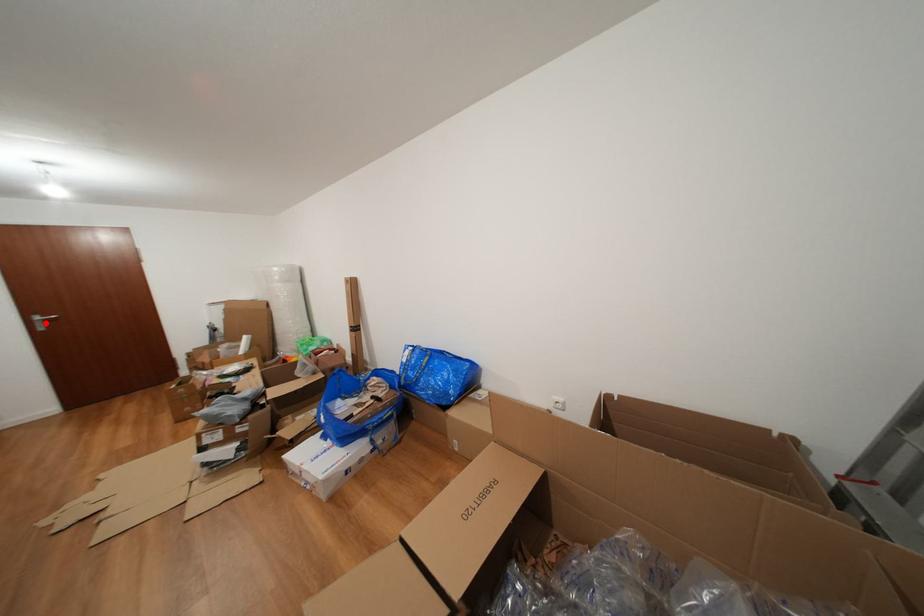
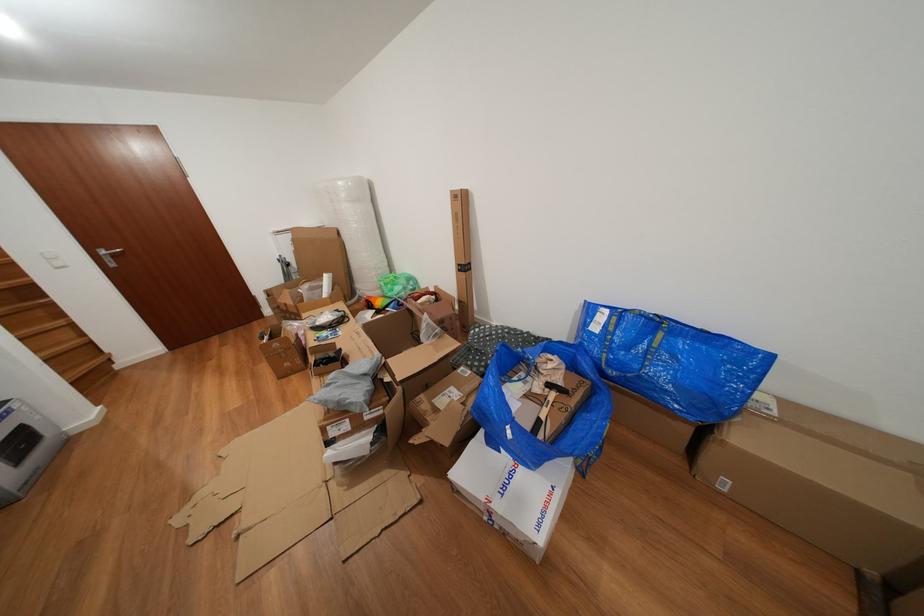
The point at the highlighted location is marked in the first image. Where is the corresponding point in the second image?

(112, 257)